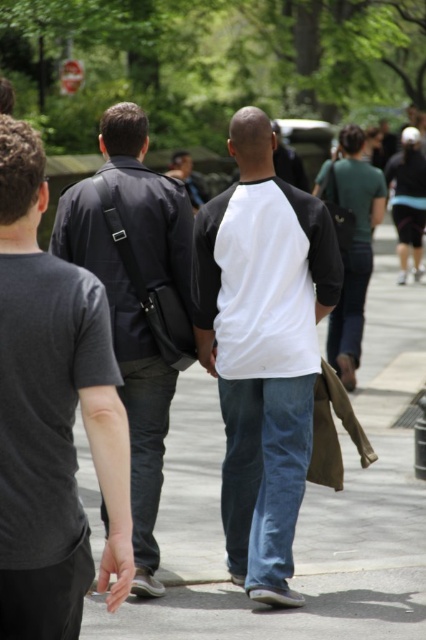
Is blue jeans at center thinner than dark gray fabric jacket at center?

In fact, blue jeans at center might be wider than dark gray fabric jacket at center.

From the picture: Does blue jeans at center have a greater height compared to dark gray fabric jacket at center?

No, blue jeans at center is not taller than dark gray fabric jacket at center.

Locate an element on the screen. blue jeans at center is located at coordinates (301, 508).

Who is taller, dark gray cotton shirt at left or white jersey at center?

white jersey at center is taller.

Is dark gray cotton shirt at left above white jersey at center?

Indeed, dark gray cotton shirt at left is positioned over white jersey at center.

Is point (115, 518) positioned in front of point (222, 276)?

That is True.

Find the location of `dark gray cotton shirt at left`. dark gray cotton shirt at left is located at coordinates (51, 413).

Is blue jeans at center in front of dark gray cotton shirt at left?

No, it is not.

Who is taller, blue jeans at center or dark gray cotton shirt at left?

dark gray cotton shirt at left is taller.

In order to click on blue jeans at center in this screenshot , I will do `click(301, 508)`.